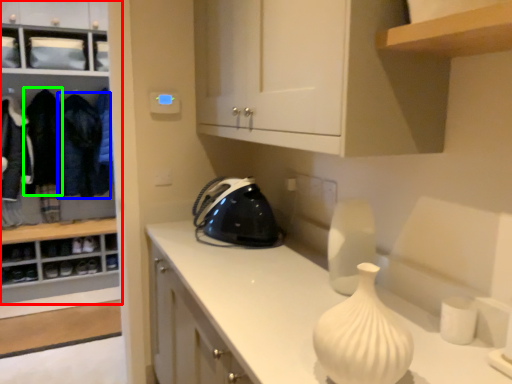
Question: Which is farther away from cabinetry (highlighted by a red box)? clothing (highlighted by a blue box) or clothing (highlighted by a green box)?

Choices:
 (A) clothing
 (B) clothing

Answer: (B)